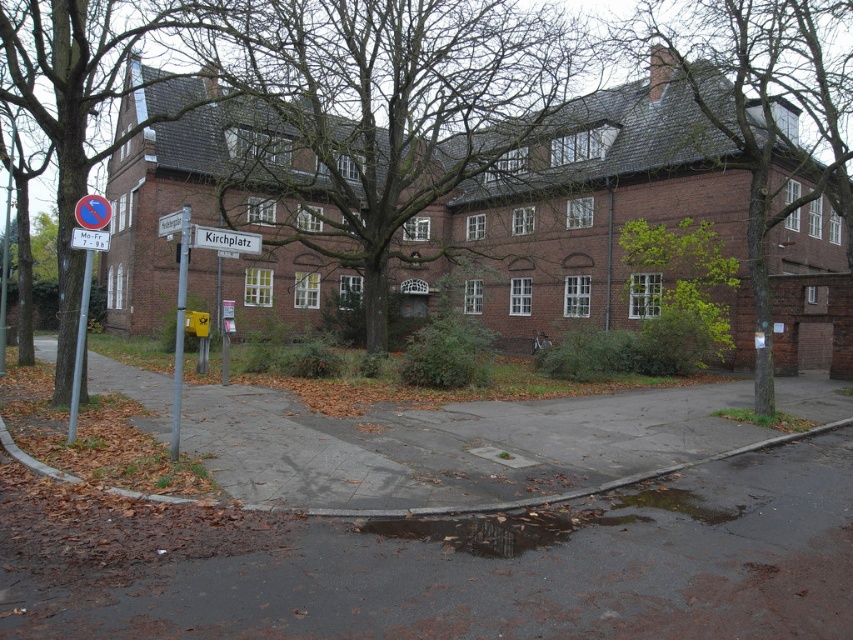
Is green leafy tree at upper right shorter than white plastic sign at upper center?

Incorrect, green leafy tree at upper right's height does not fall short of white plastic sign at upper center's.

Does green leafy tree at upper right have a larger size compared to white plastic sign at upper center?

Correct, green leafy tree at upper right is larger in size than white plastic sign at upper center.

In order to click on green leafy tree at upper right in this screenshot , I will do `click(759, 108)`.

This screenshot has height=640, width=853. What are the coordinates of `green leafy tree at upper right` in the screenshot? It's located at (759, 108).

Can you confirm if bare branches at center is wider than green leafy tree at center?

Indeed, bare branches at center has a greater width compared to green leafy tree at center.

Is bare branches at center below green leafy tree at center?

No, bare branches at center is not below green leafy tree at center.

Locate an element on the screen. The height and width of the screenshot is (640, 853). bare branches at center is located at coordinates (376, 109).

Does dark reflective wet pavement at lower center have a greater width compared to green leafy tree at center?

Correct, the width of dark reflective wet pavement at lower center exceeds that of green leafy tree at center.

Which is more to the right, dark reflective wet pavement at lower center or green leafy tree at center?

green leafy tree at center is more to the right.

The image size is (853, 640). I want to click on dark reflective wet pavement at lower center, so 498,529.